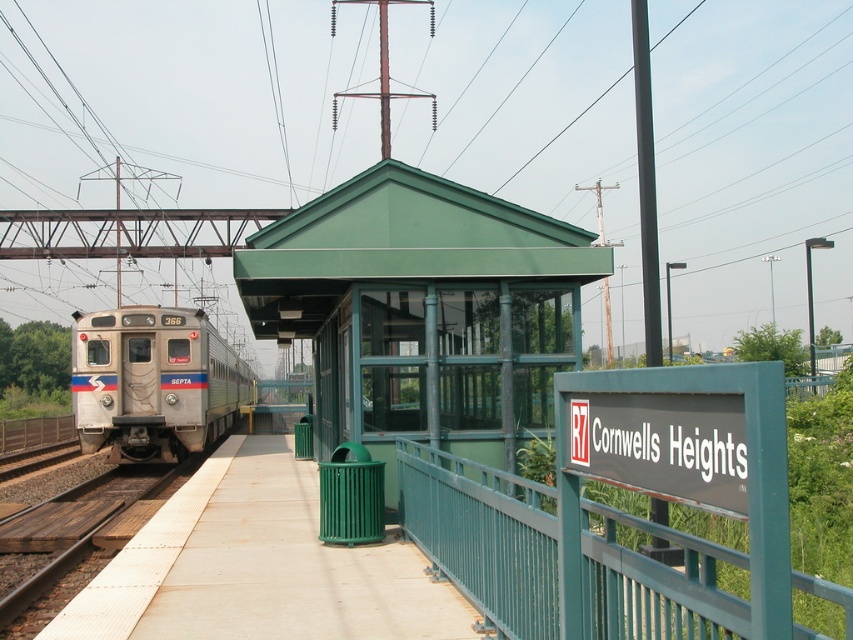
Does smooth concrete platform at center have a smaller size compared to silver metallic train at left?

Yes, smooth concrete platform at center is smaller than silver metallic train at left.

Is smooth concrete platform at center above silver metallic train at left?

Actually, smooth concrete platform at center is below silver metallic train at left.

Does point (374, 584) come farther from viewer compared to point (154, 372)?

No.

In order to click on smooth concrete platform at center in this screenshot , I will do `click(258, 566)`.